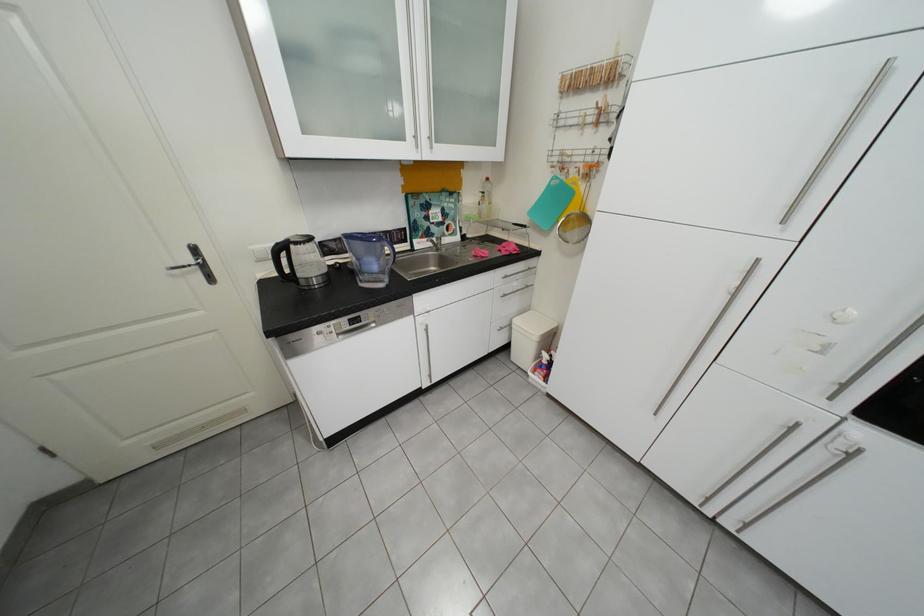
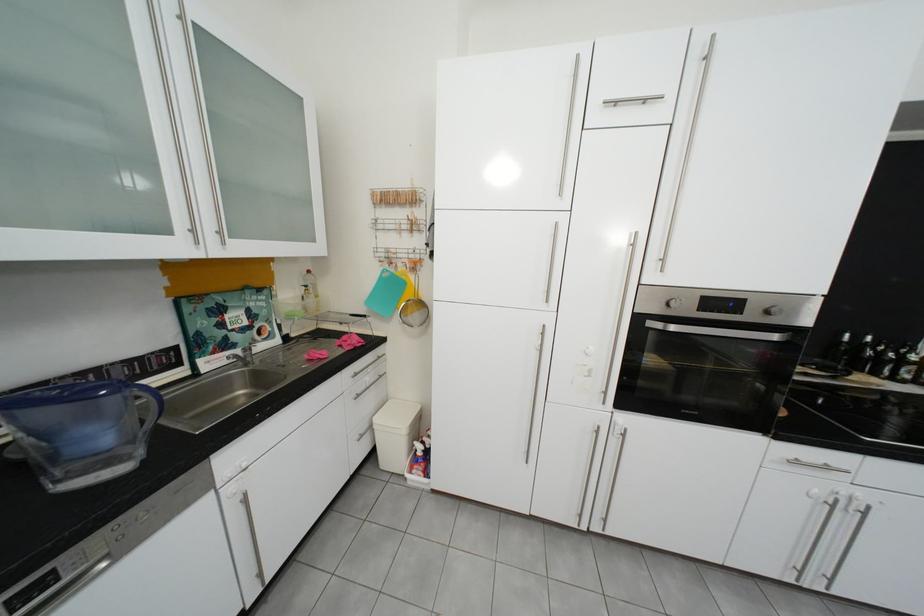
In the second image, find the point that corresponds to the point at 575,79 in the first image.

(385, 195)